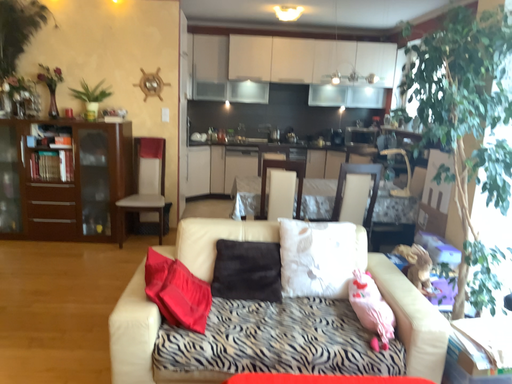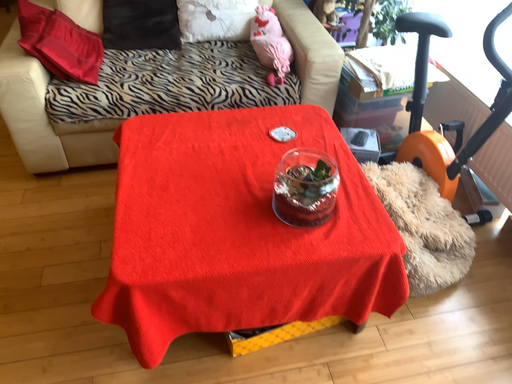
Question: How did the camera likely rotate when shooting the video?

Choices:
 (A) rotated upward
 (B) rotated downward

Answer: (B)